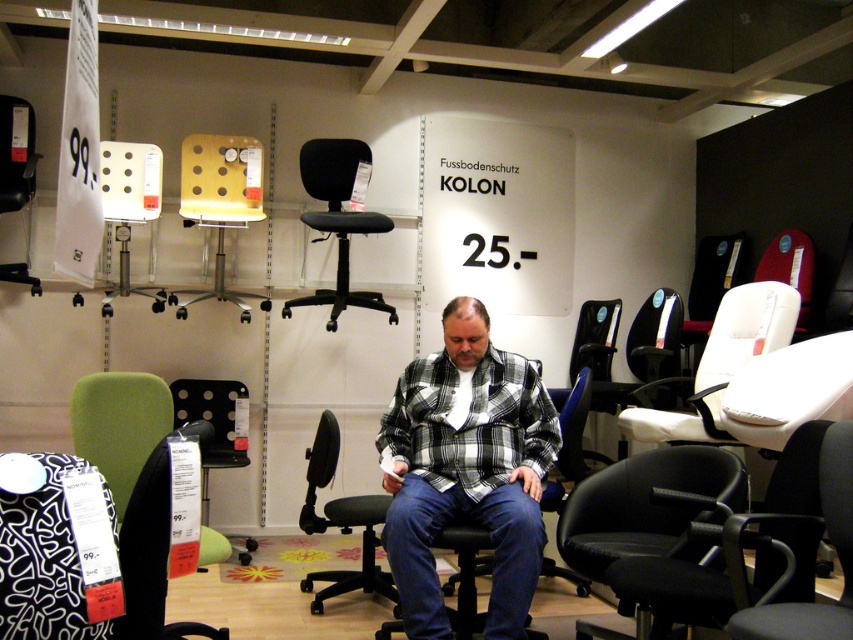
Question: Among these points, which one is nearest to the camera?

Choices:
 (A) (524, 369)
 (B) (328, 321)

Answer: (A)

Question: Can you confirm if plaid shirt at center is smaller than black fabric office chair at center?

Choices:
 (A) yes
 (B) no

Answer: (A)

Question: Can you confirm if green fabric armchair at lower left is positioned to the right of black fabric office chair at center?

Choices:
 (A) yes
 (B) no

Answer: (B)

Question: Among these objects, which one is farthest from the camera?

Choices:
 (A) plaid shirt at center
 (B) green fabric armchair at lower left
 (C) black fabric office chair at center

Answer: (C)

Question: Which of these objects is positioned closest to the black fabric office chair at center?

Choices:
 (A) plaid shirt at center
 (B) green fabric armchair at lower left

Answer: (A)

Question: Can you confirm if green fabric armchair at lower left is positioned to the left of black fabric office chair at center?

Choices:
 (A) yes
 (B) no

Answer: (A)